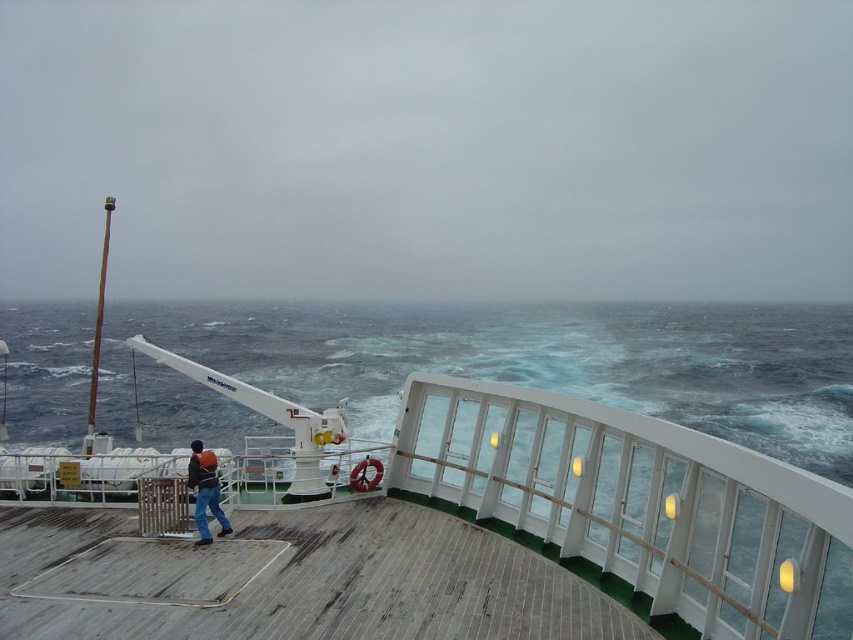
Question: Can you confirm if blue water at center is bigger than weathered wood deck at center?

Choices:
 (A) no
 (B) yes

Answer: (B)

Question: Is blue water at center above dark blue jeans at lower left?

Choices:
 (A) no
 (B) yes

Answer: (B)

Question: Which point is closer to the camera taking this photo?

Choices:
 (A) (524, 362)
 (B) (444, 561)
 (C) (223, 515)

Answer: (B)

Question: Which object is the farthest from the white matte crane at upper left?

Choices:
 (A) dark blue jeans at lower left
 (B) blue water at center
 (C) weathered wood deck at center

Answer: (B)

Question: Is white matte crane at upper left in front of dark blue jeans at lower left?

Choices:
 (A) yes
 (B) no

Answer: (A)

Question: Which of these objects is positioned farthest from the weathered wood deck at center?

Choices:
 (A) white matte crane at upper left
 (B) blue water at center

Answer: (B)